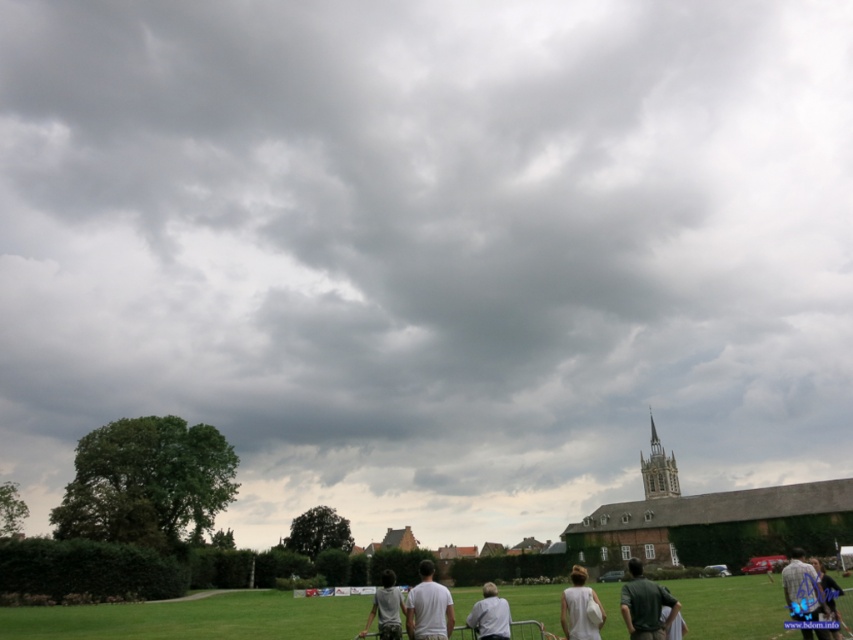
Question: Which of the following is the farthest from the observer?

Choices:
 (A) (813, 618)
 (B) (480, 611)
 (C) (436, 628)

Answer: (B)

Question: Can you confirm if white cotton dress at lower center is thinner than light gray fabric shirt at center?

Choices:
 (A) no
 (B) yes

Answer: (A)

Question: Which point appears closest to the camera in this image?

Choices:
 (A) (x=795, y=552)
 (B) (x=380, y=595)
 (C) (x=819, y=598)
 (D) (x=502, y=618)

Answer: (C)

Question: Is green fabric shirt at lower right wider than white cotton dress at lower center?

Choices:
 (A) yes
 (B) no

Answer: (A)

Question: Where is blue denim jeans at lower right located in relation to light gray fabric shirt at center in the image?

Choices:
 (A) above
 (B) below

Answer: (A)

Question: Which point appears farthest from the camera in this image?

Choices:
 (A) (788, 580)
 (B) (421, 627)

Answer: (A)